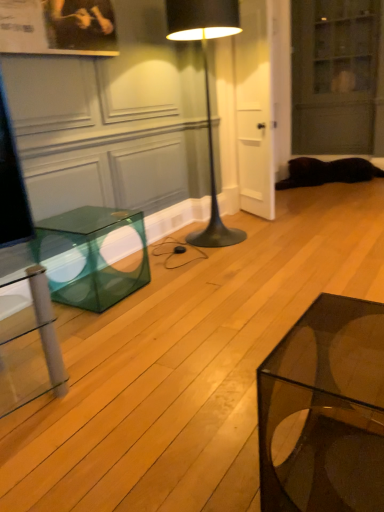
Image resolution: width=384 pixels, height=512 pixels. Describe the element at coordinates (338, 77) in the screenshot. I see `transparent glass cabinet at upper right` at that location.

Where is `transparent glass coffee table at lower right`? This screenshot has height=512, width=384. transparent glass coffee table at lower right is located at coordinates (324, 411).

This screenshot has width=384, height=512. I want to click on black fur cat at lower right, so click(x=328, y=172).

The image size is (384, 512). What are the coordinates of `black metal floor lamp at center` in the screenshot? It's located at (206, 90).

Can you confirm if black metal floor lamp at center is thinner than transparent glass cabinet at upper right?

Incorrect, the width of black metal floor lamp at center is not less than that of transparent glass cabinet at upper right.

Is transparent glass cabinet at upper right surrounded by black metal floor lamp at center?

No, black metal floor lamp at center does not contain transparent glass cabinet at upper right.

Which of these two, transparent glass cabinet at upper right or transparent glass cube at left, stands taller?

transparent glass cabinet at upper right.

Is transparent glass cabinet at upper right at the right side of transparent glass cube at left?

Yes, transparent glass cabinet at upper right is to the right of transparent glass cube at left.

Which object is wider, transparent glass cabinet at upper right or transparent glass cube at left?

Wider between the two is transparent glass cube at left.

Is transparent glass cabinet at upper right positioned far away from transparent glass cube at left?

Yes, transparent glass cabinet at upper right is far from transparent glass cube at left.

I want to click on cat above the transparent glass coffee table at lower right (from the image's perspective), so tap(328, 172).

How many degrees apart are the facing directions of black fur cat at lower right and transparent glass coffee table at lower right?

There is a 4.17-degree angle between the facing directions of black fur cat at lower right and transparent glass coffee table at lower right.

Does black fur cat at lower right have a smaller size compared to transparent glass coffee table at lower right?

No.

From the image's perspective, between black fur cat at lower right and transparent glass coffee table at lower right, which one is located above?

black fur cat at lower right, from the image's perspective.

Consider the image. Is black fur cat at lower right further to camera compared to transparent glass cube at left?

That is True.

Find the location of a particular element. cat on the right of transparent glass cube at left is located at coordinates (328, 172).

Between black fur cat at lower right and transparent glass cube at left, which one has smaller width?

transparent glass cube at left.

Is there a large distance between black fur cat at lower right and transparent glass cube at left?

Yes, black fur cat at lower right and transparent glass cube at left are located far from each other.

Is transparent glass cube at left not within black fur cat at lower right?

Yes, transparent glass cube at left is outside of black fur cat at lower right.

Is transparent glass cube at left touching black fur cat at lower right?

No.

Who is taller, transparent glass cube at left or black fur cat at lower right?

Standing taller between the two is transparent glass cube at left.

Is transparent glass cube at left oriented away from black fur cat at lower right?

No.

Considering the sizes of objects black metal floor lamp at center and transparent glass cube at left in the image provided, who is thinner, black metal floor lamp at center or transparent glass cube at left?

transparent glass cube at left.

Consider the image. Considering the sizes of objects black metal floor lamp at center and transparent glass cube at left in the image provided, who is bigger, black metal floor lamp at center or transparent glass cube at left?

black metal floor lamp at center is bigger.

Is black metal floor lamp at center completely or partially outside of transparent glass cube at left?

Yes.

Is point (320, 18) in front of point (343, 374)?

No, it is not.

At what (x,y) coordinates should I click in order to perform the action: click on glass door located above the transparent glass coffee table at lower right (from the image's perspective). Please return your answer as a coordinate pair (x, y). Looking at the image, I should click on pos(338,77).

Can you confirm if transparent glass cabinet at upper right is shorter than transparent glass coffee table at lower right?

Incorrect, the height of transparent glass cabinet at upper right does not fall short of that of transparent glass coffee table at lower right.

Would you consider transparent glass cabinet at upper right to be distant from transparent glass coffee table at lower right?

transparent glass cabinet at upper right is positioned a significant distance from transparent glass coffee table at lower right.

Image resolution: width=384 pixels, height=512 pixels. What are the coordinates of `lamp below the transparent glass cabinet at upper right (from a real-world perspective)` in the screenshot? It's located at (206, 90).

This screenshot has height=512, width=384. What are the coordinates of `glass door on the right of the transparent glass cube at left` in the screenshot? It's located at (338, 77).

Which object lies nearer to the anchor point black metal floor lamp at center, transparent glass cabinet at upper right or transparent glass coffee table at lower right?

transparent glass coffee table at lower right.

Looking at the image, which one is located closer to transparent glass cube at left, transparent glass coffee table at lower right or black fur cat at lower right?

Among the two, transparent glass coffee table at lower right is located nearer to transparent glass cube at left.

Looking at the image, which one is located further to black metal floor lamp at center, black fur cat at lower right or transparent glass coffee table at lower right?

Based on the image, black fur cat at lower right appears to be further to black metal floor lamp at center.

From the image, which object appears to be farther from transparent glass cube at left, black metal floor lamp at center or transparent glass coffee table at lower right?

The object further to transparent glass cube at left is transparent glass coffee table at lower right.

Considering their positions, is black metal floor lamp at center positioned further to transparent glass cabinet at upper right than transparent glass coffee table at lower right?

Among the two, transparent glass coffee table at lower right is located further to transparent glass cabinet at upper right.

Based on the photo, considering their positions, is black metal floor lamp at center positioned further to transparent glass cabinet at upper right than black fur cat at lower right?

Based on the image, black metal floor lamp at center appears to be further to transparent glass cabinet at upper right.

When comparing their distances from black metal floor lamp at center, does black fur cat at lower right or transparent glass cabinet at upper right seem closer?

black fur cat at lower right is closer to black metal floor lamp at center.

From the picture: From the image, which object appears to be farther from transparent glass cabinet at upper right, black metal floor lamp at center or transparent glass cube at left?

transparent glass cube at left.

The image size is (384, 512). In order to click on lamp located between transparent glass coffee table at lower right and transparent glass cabinet at upper right in the depth direction in this screenshot , I will do `click(206, 90)`.

Identify the location of lamp between transparent glass cube at left and black fur cat at lower right from left to right. Image resolution: width=384 pixels, height=512 pixels. (206, 90).

The image size is (384, 512). In order to click on cat between black metal floor lamp at center and transparent glass cabinet at upper right along the z-axis in this screenshot , I will do `click(328, 172)`.

At what (x,y) coordinates should I click in order to perform the action: click on lamp located between transparent glass coffee table at lower right and black fur cat at lower right in the depth direction. Please return your answer as a coordinate pair (x, y). Image resolution: width=384 pixels, height=512 pixels. Looking at the image, I should click on (206, 90).